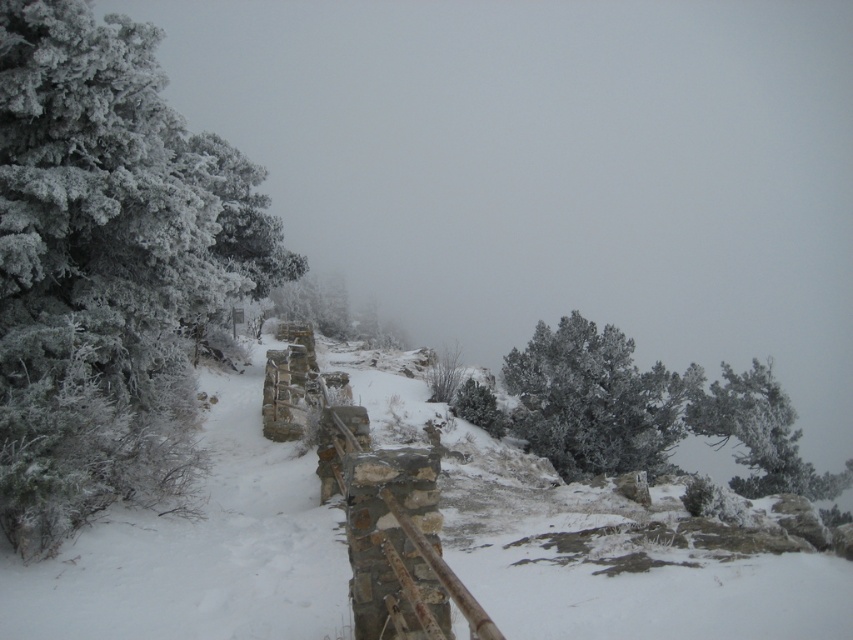
You are a hiker planning to take a photo of the frosted evergreen at left and the white frosty tree at upper right. Which tree should you position lower in your camera frame to include both in the shot?

The frosted evergreen at left is located above the white frosty tree at upper right, so to include both in the shot, you should position the white frosty tree at upper right lower in your camera frame.

You are a hiker trying to follow the path in the winter scene. You see the white frosty snow at center and the frosted pine tree at upper center. Which one is higher up the slope?

The white frosty snow at center is above the frosted pine tree at upper center, so the white frosty snow at center is higher up the slope.